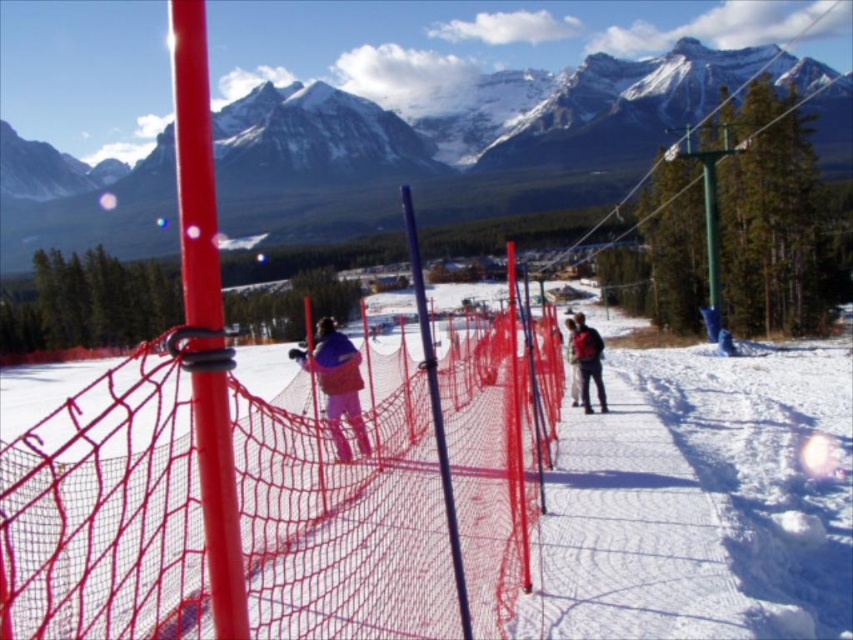
Question: Which object appears closest to the camera in this image?

Choices:
 (A) white snow pants at center
 (B) smooth plastic pole at center

Answer: (B)

Question: Can you confirm if smooth plastic pole at center is positioned below matte black jacket at center?

Choices:
 (A) yes
 (B) no

Answer: (B)

Question: Which point is farther to the camera?

Choices:
 (A) (573, 356)
 (B) (209, 396)
 (C) (18, 230)
 (D) (567, 323)

Answer: (C)

Question: Considering the real-world distances, which object is closest to the matte red net at center?

Choices:
 (A) matte black jacket at center
 (B) white snow pants at center
 (C) metallic blue pole at center

Answer: (C)

Question: Is matte blue jacket at center above metallic blue pole at center?

Choices:
 (A) no
 (B) yes

Answer: (A)

Question: Considering the relative positions of smooth plastic pole at center and white snow pants at center in the image provided, where is smooth plastic pole at center located with respect to white snow pants at center?

Choices:
 (A) left
 (B) right

Answer: (A)